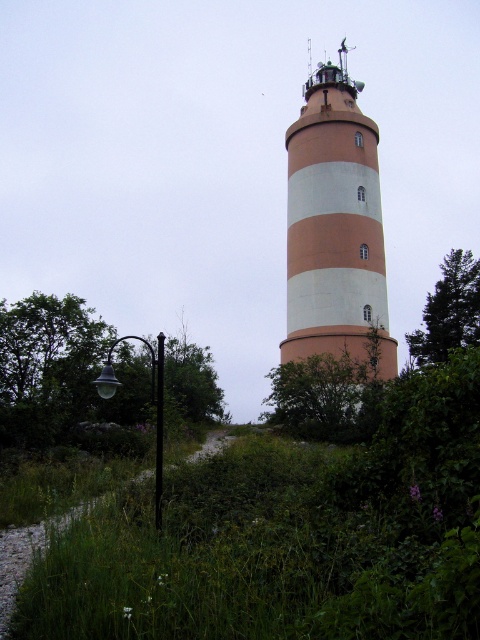
Question: Can you confirm if green leafy tree at lower left is thinner than green leafy tree at right?

Choices:
 (A) no
 (B) yes

Answer: (A)

Question: Can you confirm if orange matte tower at center is bigger than green leafy tree at right?

Choices:
 (A) yes
 (B) no

Answer: (A)

Question: Which object is positioned closest to the orange matte tower at center?

Choices:
 (A) gravel path at lower left
 (B) green leafy tree at lower left
 (C) green leafy tree at right

Answer: (C)

Question: Which object is closer to the camera taking this photo?

Choices:
 (A) green leafy tree at right
 (B) orange matte tower at center

Answer: (B)

Question: Does orange matte tower at center have a larger size compared to green leafy tree at right?

Choices:
 (A) no
 (B) yes

Answer: (B)

Question: Which point appears farthest from the camera in this image?

Choices:
 (A) coord(335,92)
 (B) coord(39,522)
 (C) coord(466,275)
 (D) coord(52,362)

Answer: (A)